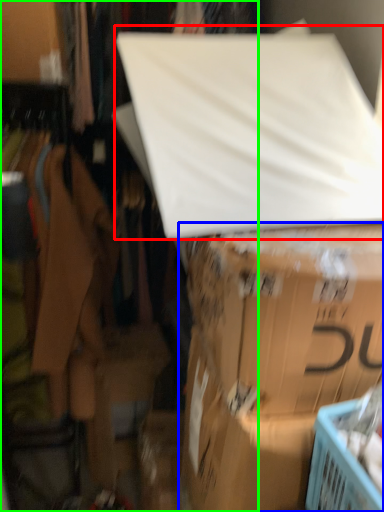
Question: Which object is the farthest from linen (highlighted by a red box)? Choose among these: box (highlighted by a blue box) or closet (highlighted by a green box).

Choices:
 (A) box
 (B) closet

Answer: (B)